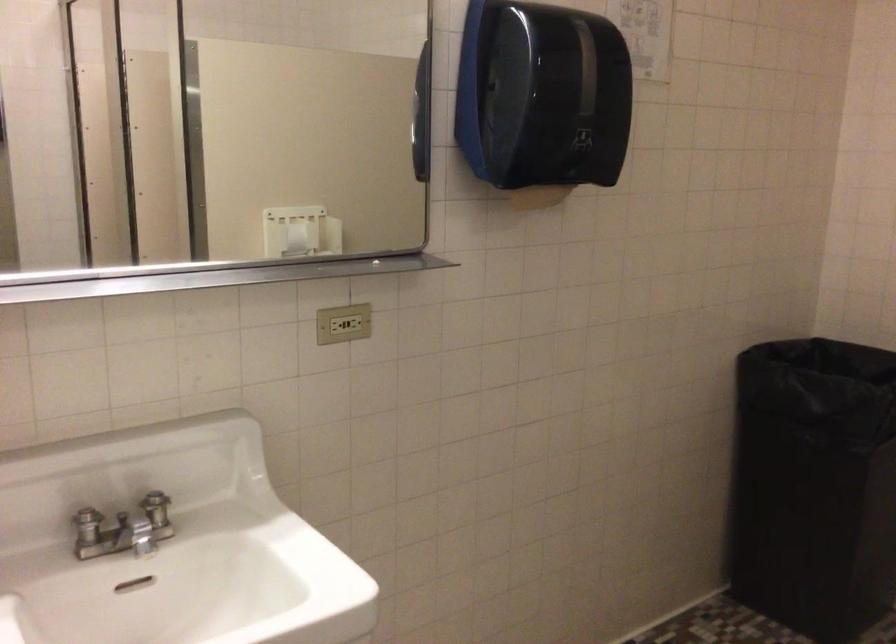
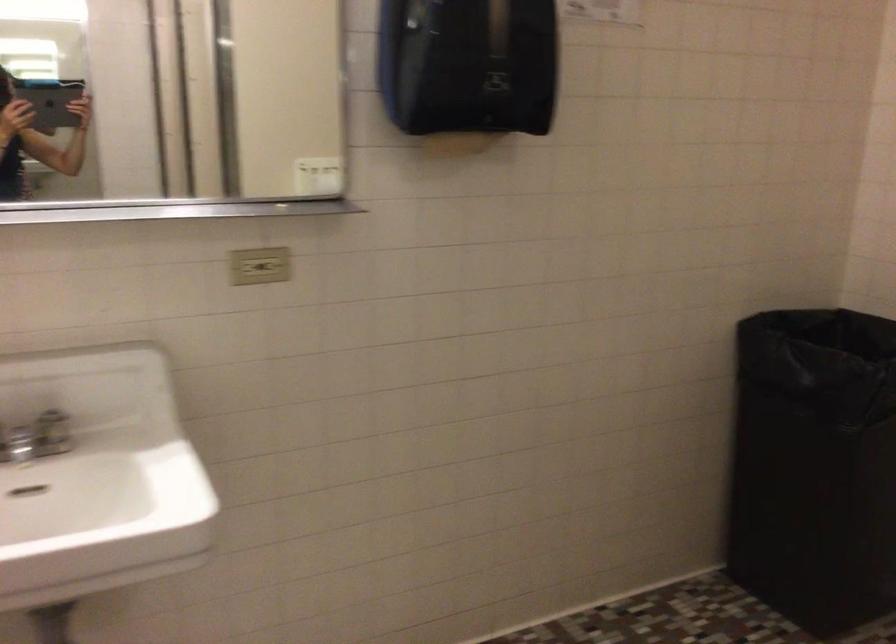
Where in the second image is the point corresponding to the point at 553,118 from the first image?

(468, 64)